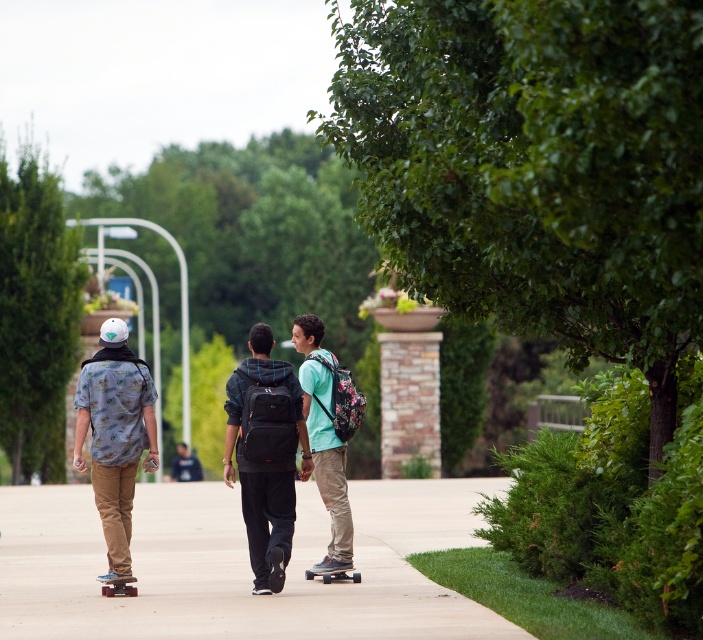
Does smooth concrete sidewalk at center have a larger size compared to floral-patterned shirt at left?

Indeed, smooth concrete sidewalk at center has a larger size compared to floral-patterned shirt at left.

Between smooth concrete sidewalk at center and floral-patterned shirt at left, which one is positioned higher?

Positioned higher is floral-patterned shirt at left.

The image size is (703, 640). Find the location of `smooth concrete sidewalk at center`. smooth concrete sidewalk at center is located at coordinates (238, 564).

Between floral-patterned shirt at left and wooden skateboard at center, which one is positioned lower?

wooden skateboard at center

Who is shorter, floral-patterned shirt at left or wooden skateboard at center?

wooden skateboard at center

Which is behind, point (93, 394) or point (116, 584)?

The point (116, 584) is more distant.

Where is `floral-patterned shirt at left`? This screenshot has height=640, width=703. floral-patterned shirt at left is located at coordinates (115, 433).

Who is positioned more to the right, black backpack at center or wooden skateboard at center?

black backpack at center is more to the right.

Which of these two, black backpack at center or wooden skateboard at center, stands shorter?

Standing shorter between the two is wooden skateboard at center.

Between point (240, 381) and point (115, 582), which one is positioned behind?

Point (115, 582)

At what (x,y) coordinates should I click in order to perform the action: click on black backpack at center. Please return your answer as a coordinate pair (x, y). The image size is (703, 640). Looking at the image, I should click on (278, 468).